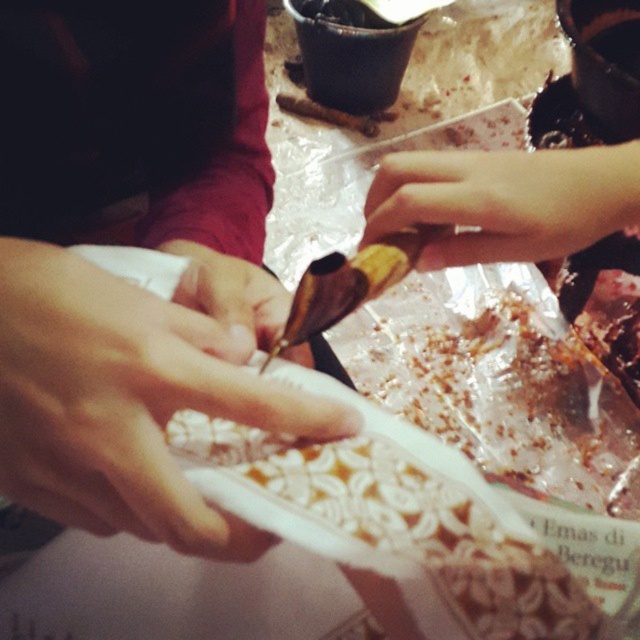
You are trying to determine which of the two points, point [86,531] or point [200,244], is closer to you in the image. Based on the scene description, which point is nearer?

Point [86,531] is closer to the viewer than point [200,244].

Looking at the scene where hands are preparing food with a white matte plate at center and smooth skin at center, which object is positioned to the right side?

The smooth skin at center is to the right of the white matte plate at center.

You are a chef preparing a dish and need to place a garnish on the white matte plate at center. Given that the pale skin at upper right is nearby, will the plate fit comfortably under your hand for garnishing without slipping?

The white matte plate at center is larger in size than the pale skin at upper right, so it should provide a stable and secure surface for garnishing without slipping.